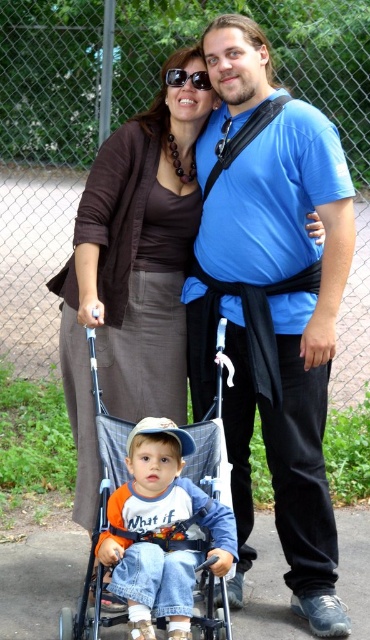
Question: Can you confirm if blue cotton shirt at center is thinner than sunglasses at center?

Choices:
 (A) no
 (B) yes

Answer: (A)

Question: Which point is closer to the camera?

Choices:
 (A) (236, 74)
 (B) (203, 76)

Answer: (A)

Question: In this image, where is blue fabric stroller at center located relative to sunglasses at center?

Choices:
 (A) below
 (B) above

Answer: (A)

Question: Based on their relative distances, which object is nearer to the sunglasses at center?

Choices:
 (A) blue fabric stroller at center
 (B) blue cotton shirt at center

Answer: (B)

Question: Considering the relative positions of blue fabric stroller at center and sunglasses at center in the image provided, where is blue fabric stroller at center located with respect to sunglasses at center?

Choices:
 (A) right
 (B) left

Answer: (B)

Question: Estimate the real-world distances between objects in this image. Which object is closer to the blue fabric stroller at center?

Choices:
 (A) blue cotton shirt at center
 (B) sunglasses at center

Answer: (A)